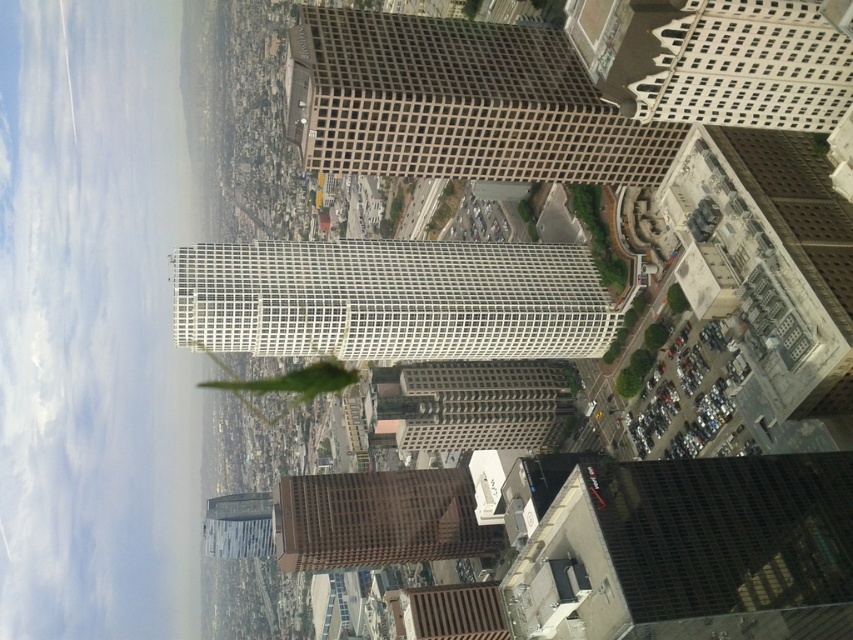
You are an architect evaluating the urban layout. Based on the scene, which building has a greater width between the white glassy skyscraper at center and the white textured building at upper right?

The white glassy skyscraper at center has a greater width than the white textured building at upper right according to the description.

You are an urban planner assessing the skyline of this city. You notice the green matte tower at center and the white glassy skyscraper at center. Which of these two buildings would require less space on the city map if you were to draw their outlines?

The green matte tower at center has a smaller size compared to the white glassy skyscraper at center, so it would require less space on the city map when drawing their outlines.

Based on the coordinates provided in the scene description, where is the green matte tower at center located?

The green matte tower at center is located at point (x=457, y=102).